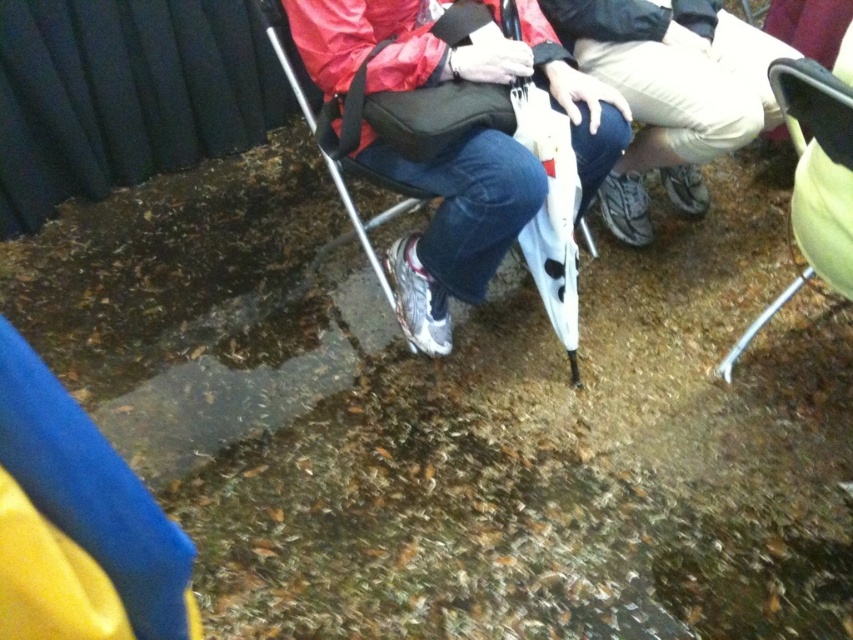
Is khaki cotton pants at center further to camera compared to metallic silver chair at center?

Yes, it is behind metallic silver chair at center.

Can you confirm if khaki cotton pants at center is shorter than metallic silver chair at center?

Indeed, khaki cotton pants at center has a lesser height compared to metallic silver chair at center.

Which is behind, point (608, 10) or point (352, 93)?

The point (608, 10) is more distant.

At what (x,y) coordinates should I click in order to perform the action: click on khaki cotton pants at center. Please return your answer as a coordinate pair (x, y). This screenshot has height=640, width=853. Looking at the image, I should click on (670, 92).

Which is in front, point (544, 257) or point (834, 284)?

Point (834, 284) is more forward.

In the scene shown: Does metallic silver chair at center have a larger size compared to green fabric folding chair at right?

Yes, metallic silver chair at center is bigger than green fabric folding chair at right.

Describe the element at coordinates (450, 147) in the screenshot. I see `metallic silver chair at center` at that location.

What are the coordinates of `metallic silver chair at center` in the screenshot? It's located at (450, 147).

Can you confirm if khaki cotton pants at center is shorter than green fabric folding chair at right?

Yes, khaki cotton pants at center is shorter than green fabric folding chair at right.

Does khaki cotton pants at center appear on the left side of green fabric folding chair at right?

Indeed, khaki cotton pants at center is positioned on the left side of green fabric folding chair at right.

This screenshot has height=640, width=853. Find the location of `khaki cotton pants at center`. khaki cotton pants at center is located at coordinates (670, 92).